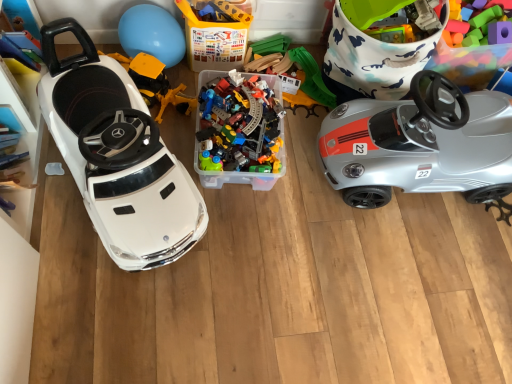
Question: From the image's perspective, is rubberized plastic steering wheel at upper right, acting as the third toy starting from the left, beneath white plastic car at left, which is the 2th car from right to left?

Choices:
 (A) no
 (B) yes

Answer: (A)

Question: Can you confirm if rubberized plastic steering wheel at upper right, acting as the third toy starting from the left, is bigger than white plastic car at left, which is the 2th car from right to left?

Choices:
 (A) yes
 (B) no

Answer: (B)

Question: From a real-world perspective, is rubberized plastic steering wheel at upper right, acting as the third toy starting from the left, physically below white plastic car at left, which is the 2th car from right to left?

Choices:
 (A) no
 (B) yes

Answer: (B)

Question: Is rubberized plastic steering wheel at upper right, acting as the third toy starting from the left, looking in the opposite direction of white plastic car at left, which is the 2th car from right to left?

Choices:
 (A) no
 (B) yes

Answer: (A)

Question: Are rubberized plastic steering wheel at upper right, acting as the third toy starting from the left, and white plastic car at left, the 1th car in the left-to-right sequence, far apart?

Choices:
 (A) yes
 (B) no

Answer: (A)

Question: Can you confirm if rubberized plastic steering wheel at upper right, acting as the 1th toy starting from the right, is positioned to the right of white plastic car at left, which is the 2th car from right to left?

Choices:
 (A) no
 (B) yes

Answer: (B)

Question: Considering the relative sizes of blue rubber balloon at upper center and silver metallic car at right, marked as the second car in a left-to-right arrangement, in the image provided, is blue rubber balloon at upper center taller than silver metallic car at right, marked as the second car in a left-to-right arrangement,?

Choices:
 (A) no
 (B) yes

Answer: (A)

Question: Is the depth of blue rubber balloon at upper center greater than that of silver metallic car at right, placed as the 1th car when sorted from right to left?

Choices:
 (A) no
 (B) yes

Answer: (B)

Question: Can you confirm if blue rubber balloon at upper center is bigger than silver metallic car at right, placed as the 1th car when sorted from right to left?

Choices:
 (A) no
 (B) yes

Answer: (A)

Question: Is the surface of blue rubber balloon at upper center in direct contact with silver metallic car at right, marked as the second car in a left-to-right arrangement?

Choices:
 (A) yes
 (B) no

Answer: (B)

Question: From the image's perspective, is blue rubber balloon at upper center under silver metallic car at right, marked as the second car in a left-to-right arrangement?

Choices:
 (A) yes
 (B) no

Answer: (B)

Question: From the image's perspective, is blue rubber balloon at upper center located above silver metallic car at right, placed as the 1th car when sorted from right to left?

Choices:
 (A) no
 (B) yes

Answer: (B)

Question: Is translucent plastic container at center at the right side of silver metallic car at right, marked as the second car in a left-to-right arrangement?

Choices:
 (A) yes
 (B) no

Answer: (B)